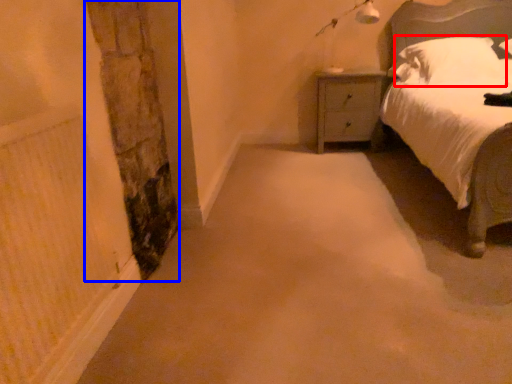
Question: Which of the following is the farthest to the observer, pillow (highlighted by a red box) or pillar (highlighted by a blue box)?

Choices:
 (A) pillow
 (B) pillar

Answer: (A)